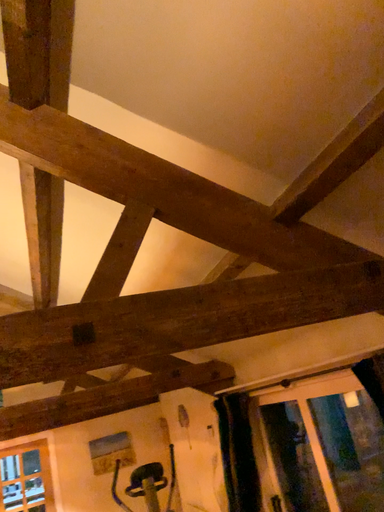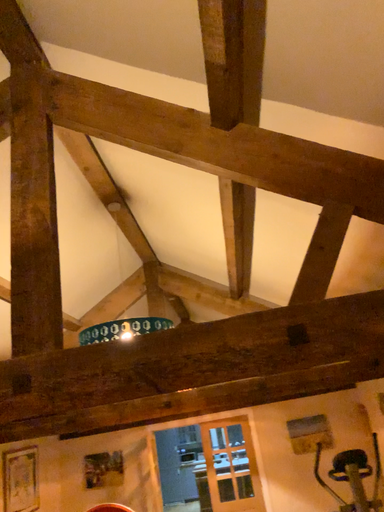
Question: Which way did the camera rotate in the video?

Choices:
 (A) rotated right
 (B) rotated left

Answer: (B)